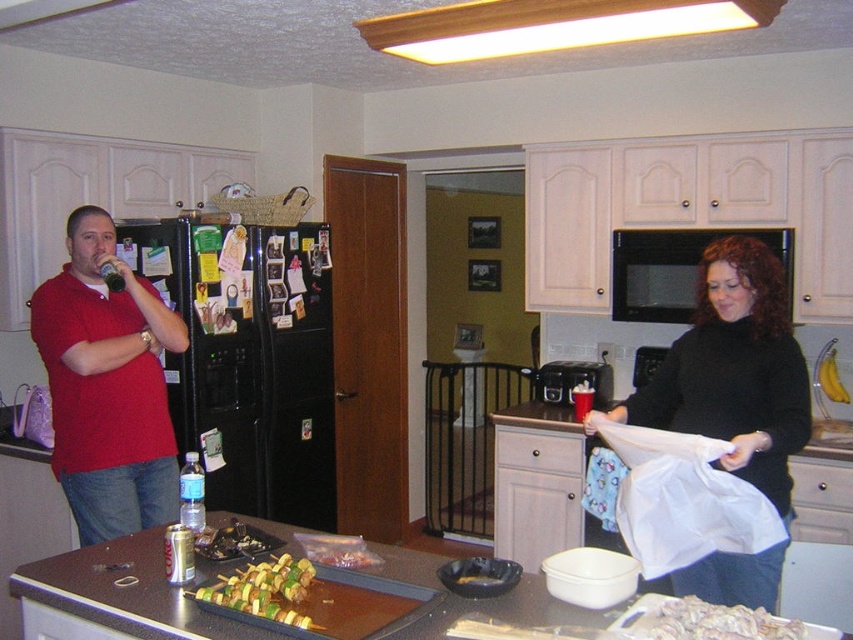
Question: Is wooden frame fluorescent light at upper center smaller than white crumbly food at lower right?

Choices:
 (A) no
 (B) yes

Answer: (A)

Question: Which point appears closest to the camera in this image?

Choices:
 (A) (666, 376)
 (B) (126, 356)

Answer: (A)

Question: Can you confirm if matte red shirt at left is positioned to the left of white crumbly food at lower right?

Choices:
 (A) yes
 (B) no

Answer: (A)

Question: Which point is closer to the camera?

Choices:
 (A) (741, 432)
 (B) (698, 637)

Answer: (B)

Question: Does black matte shirt at center have a larger size compared to wooden frame fluorescent light at upper center?

Choices:
 (A) no
 (B) yes

Answer: (B)

Question: Which object is the farthest from the white crumbly food at lower right?

Choices:
 (A) green and yellow skewers at center
 (B) matte red shirt at left
 (C) black matte shirt at center
 (D) wooden frame fluorescent light at upper center

Answer: (B)